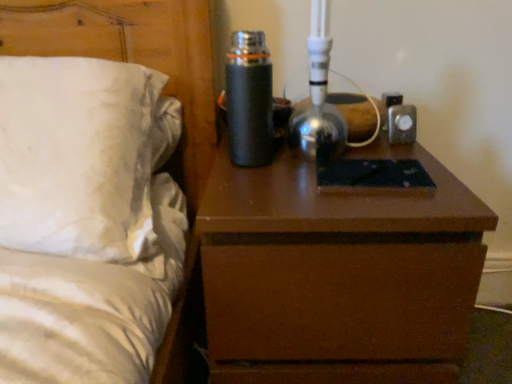
Question: Considering the relative positions of brown matte nightstand at center and white satin bed at left in the image provided, is brown matte nightstand at center to the right of white satin bed at left from the viewer's perspective?

Choices:
 (A) no
 (B) yes

Answer: (B)

Question: Is white satin bed at left at the back of brown matte nightstand at center?

Choices:
 (A) yes
 (B) no

Answer: (B)

Question: Can you confirm if brown matte nightstand at center is smaller than white satin bed at left?

Choices:
 (A) no
 (B) yes

Answer: (B)

Question: Considering the relative positions of brown matte nightstand at center and white satin bed at left in the image provided, is brown matte nightstand at center to the left of white satin bed at left from the viewer's perspective?

Choices:
 (A) no
 (B) yes

Answer: (A)

Question: Is brown matte nightstand at center closer to camera compared to white satin bed at left?

Choices:
 (A) yes
 (B) no

Answer: (B)

Question: Does brown matte nightstand at center have a lesser width compared to white satin bed at left?

Choices:
 (A) no
 (B) yes

Answer: (A)

Question: From the image's perspective, is black matte thermos at upper center below white satin bed at left?

Choices:
 (A) yes
 (B) no

Answer: (B)

Question: Does black matte thermos at upper center appear on the left side of white satin bed at left?

Choices:
 (A) yes
 (B) no

Answer: (B)

Question: Is black matte thermos at upper center to the right of white satin bed at left from the viewer's perspective?

Choices:
 (A) no
 (B) yes

Answer: (B)

Question: Can white satin bed at left be found inside black matte thermos at upper center?

Choices:
 (A) no
 (B) yes

Answer: (A)

Question: Is black matte thermos at upper center shorter than white satin bed at left?

Choices:
 (A) no
 (B) yes

Answer: (B)

Question: Is black matte thermos at upper center positioned in front of white satin bed at left?

Choices:
 (A) no
 (B) yes

Answer: (A)

Question: From the image's perspective, is brown matte nightstand at center over black matte thermos at upper center?

Choices:
 (A) yes
 (B) no

Answer: (B)